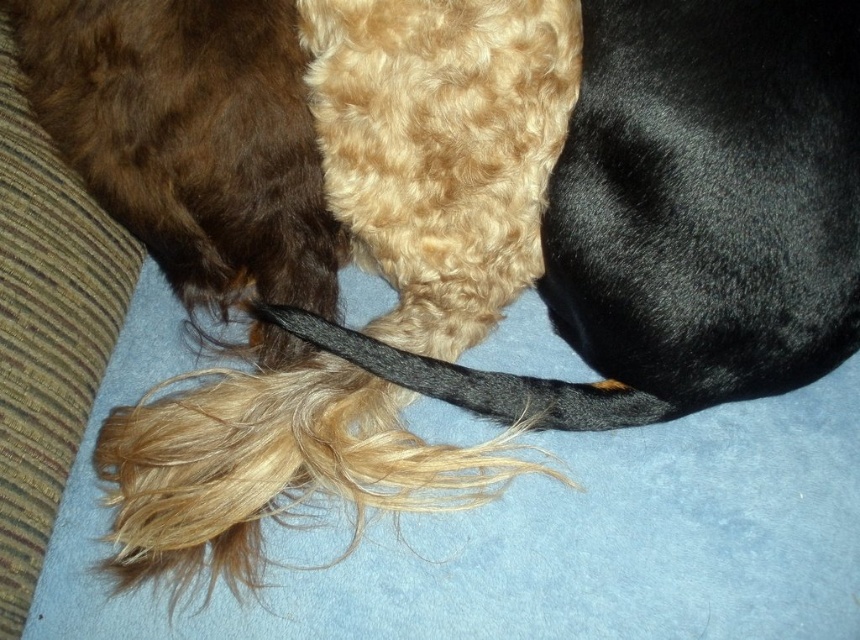
Question: Does brown fuzzy fur at upper left lie behind black silky tail at center?

Choices:
 (A) yes
 (B) no

Answer: (B)

Question: Is brown fuzzy fur at upper left to the left of black silky tail at center from the viewer's perspective?

Choices:
 (A) no
 (B) yes

Answer: (B)

Question: Which of the following is the farthest from the observer?

Choices:
 (A) black silky tail at center
 (B) brown fuzzy fur at upper left

Answer: (A)

Question: Which point is closer to the camera?

Choices:
 (A) (265, 253)
 (B) (338, 328)

Answer: (B)

Question: Among these objects, which one is nearest to the camera?

Choices:
 (A) brown fuzzy fur at upper left
 (B) black silky tail at center

Answer: (A)

Question: Does brown fuzzy fur at upper left have a larger size compared to black silky tail at center?

Choices:
 (A) yes
 (B) no

Answer: (A)